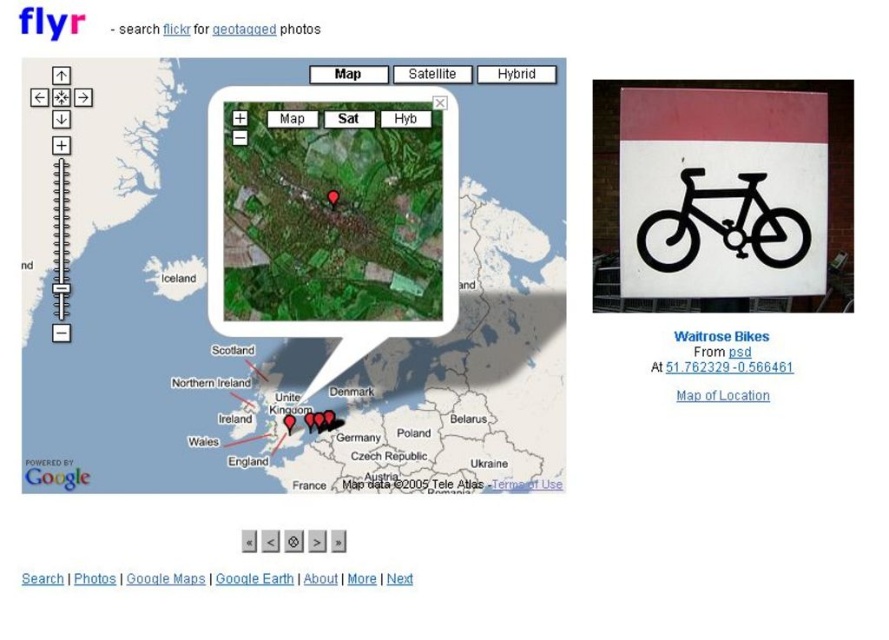
You are using the flyr website to navigate a map of Europe. You see two points marked on the map, point [159,172] and point [635,243]. Which point is closer to your current position on the map?

Point [159,172] is closer to the viewer than point [635,243].